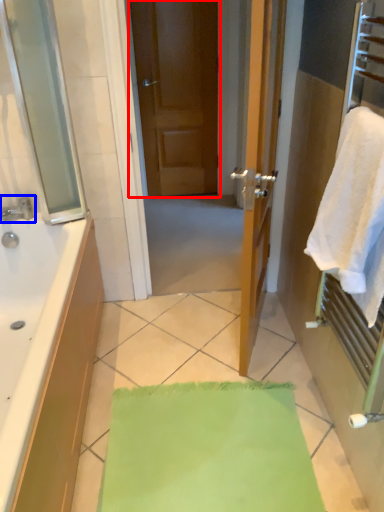
Question: Which object appears farthest to the camera in this image, door (highlighted by a red box) or tap (highlighted by a blue box)?

Choices:
 (A) door
 (B) tap

Answer: (A)